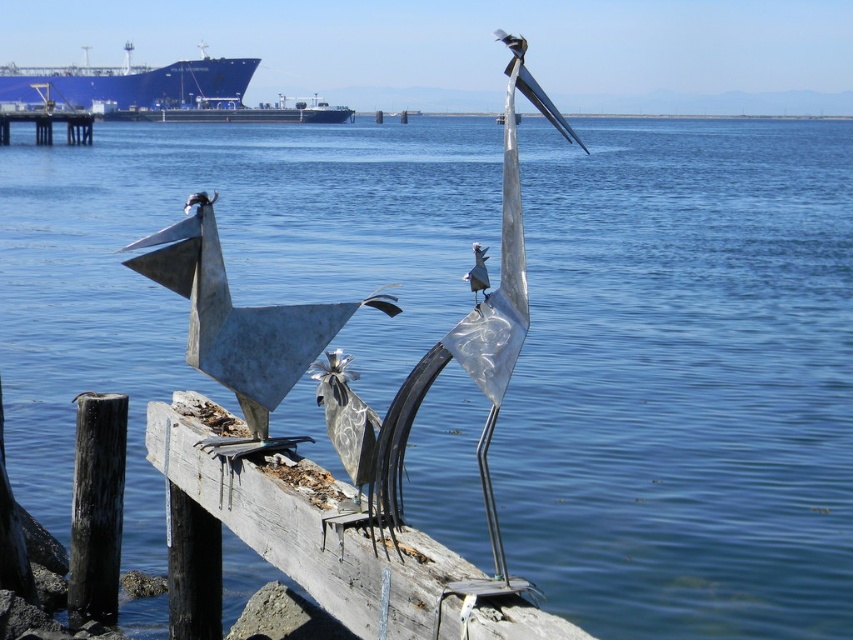
You are standing at the edge of the pier and want to walk towards the point marked as point (503, 253). However, there is an obstacle at point (346, 115). Will you encounter the obstacle before reaching your destination?

Point (503, 253) is in front of point (346, 115), so you will encounter the obstacle at point (346, 115) before reaching your destination.

You are an artist planning to paint this waterfront scene. You want to ensure the proportions of the brushed metal ship at upper left and the brushed metal dock at left are accurate. Which object should you draw wider?

The brushed metal ship at upper left should be drawn wider since its width is larger than the brushed metal dock at left according to the description.

You are a delivery drone with a wingspan of 18 feet. You need to fly between the brushed metal ship at upper left and the blue metallic ship at upper center. Can you safely pass through the space between them without touching either ship?

The distance between the brushed metal ship at upper left and the blue metallic ship at upper center is 19.72 feet. Since your drone has a wingspan of 18 feet, you can safely pass through the space between them without touching either ship.